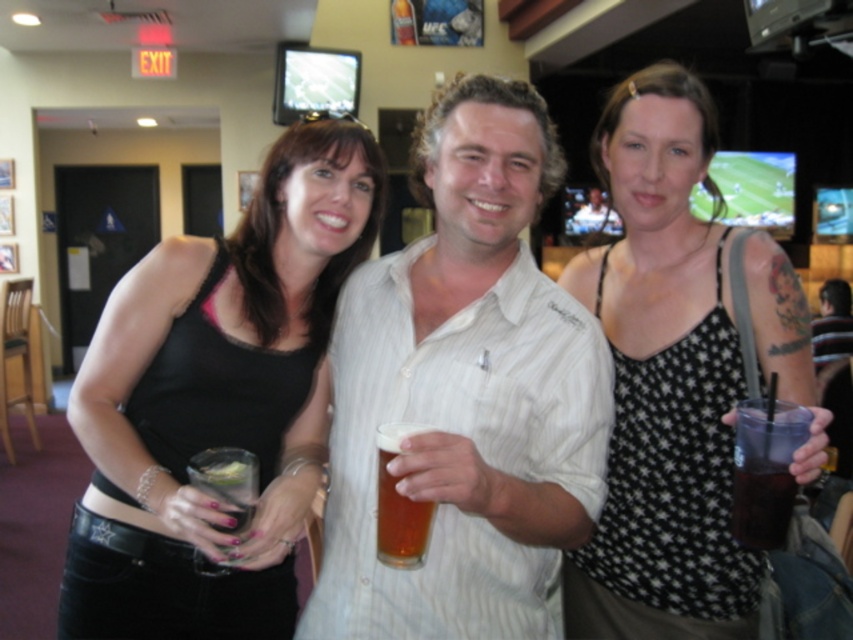
You are at a party and want to take a photo of the translucent glass beer at center without the black fabric tank top at center blocking it. How should you adjust your position?

The translucent glass beer at center is behind the black fabric tank top at center, so you should move to the side to get a clear view of the translucent glass beer at center without obstruction.

You are standing at the point with coordinates point (546, 609) and want to walk to the exit door located at point (421, 554). Since you can only move forward, will you be able to see the exit door directly in front of you without any obstructions?

Point (546, 609) is behind point (421, 554), so if you are at point (546, 609) and facing towards the exit door at point (421, 554), you would be facing away from it. Therefore, you would not see the exit door directly in front of you.

You are a photographer standing 10 feet away from a group of people. You want to take a closeup shot of the black fabric tank top at center. Can you get a clear closeup without moving closer?

The black fabric tank top at center is 3.33 feet from the viewer. Since you are currently 10 feet away, you need to move closer to 3.33 feet to capture a clear closeup.